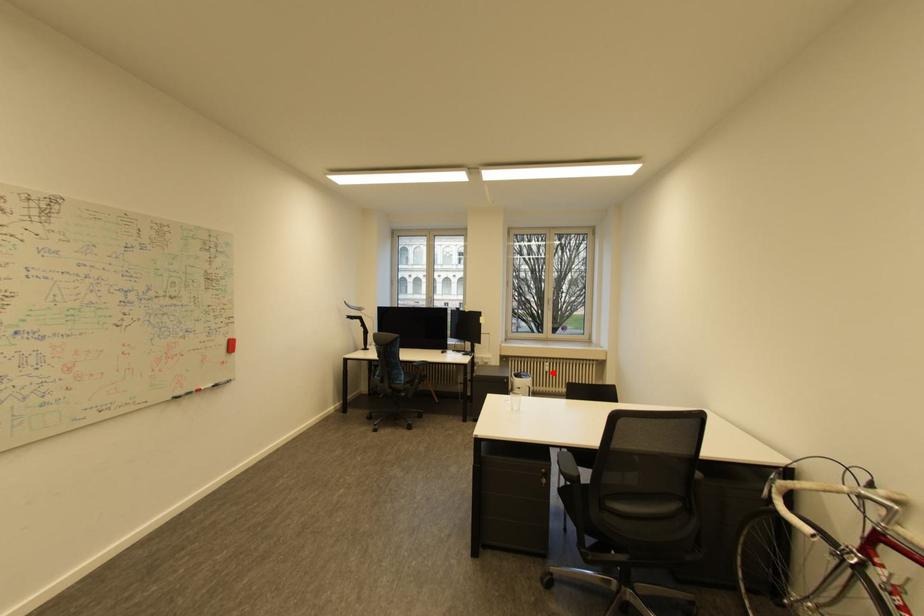
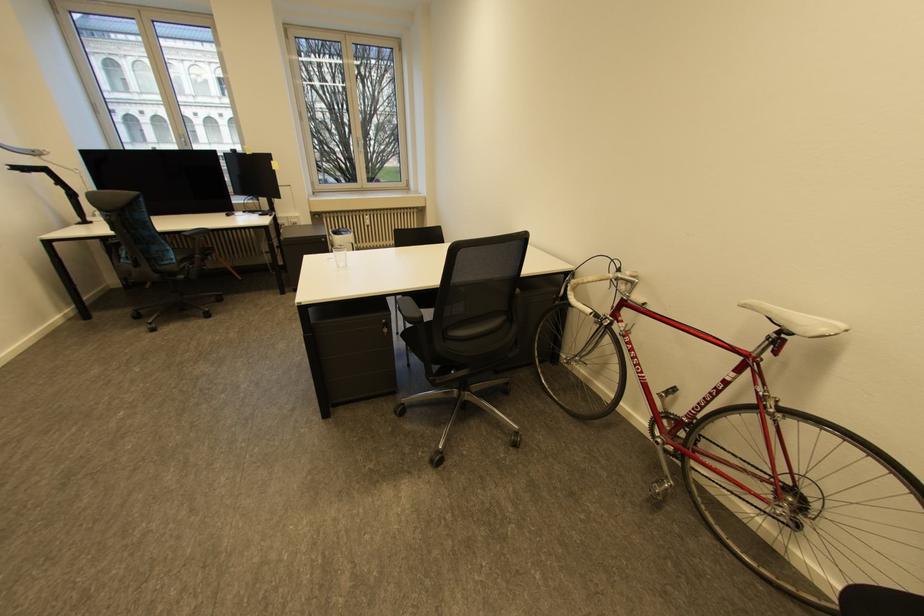
The point at the highlighted location is marked in the first image. Where is the corresponding point in the second image?

(374, 227)